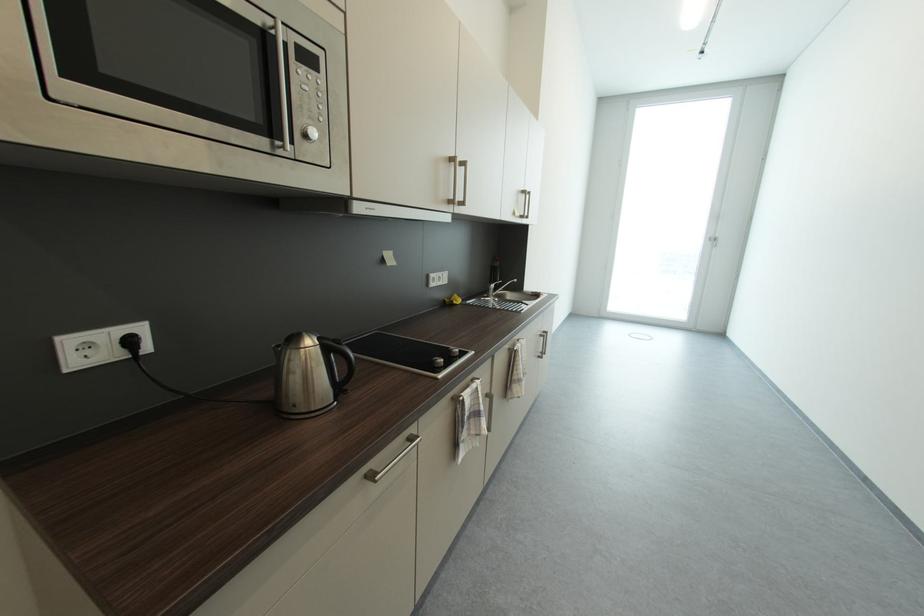
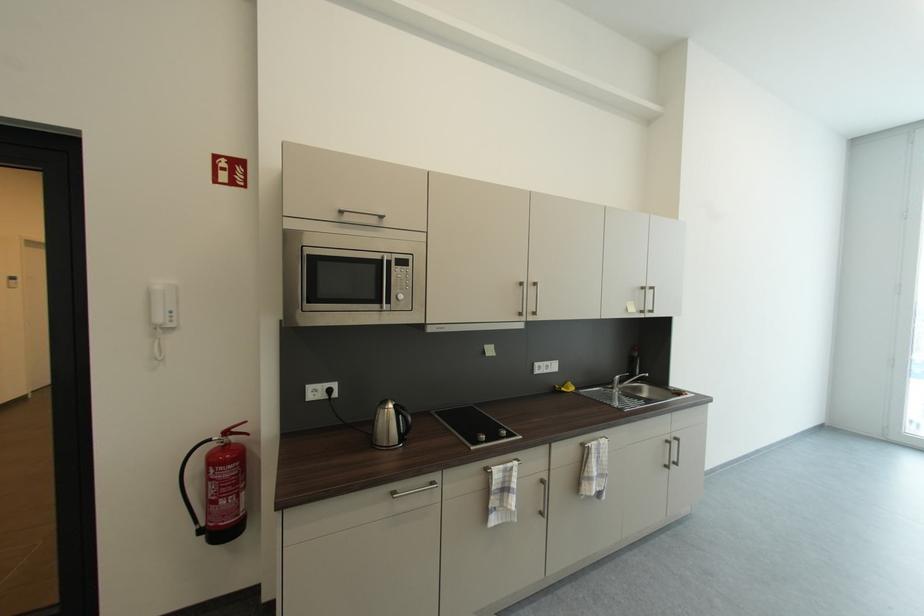
Locate, in the second image, the point that corresponds to pixel 323 342 in the first image.

(400, 407)